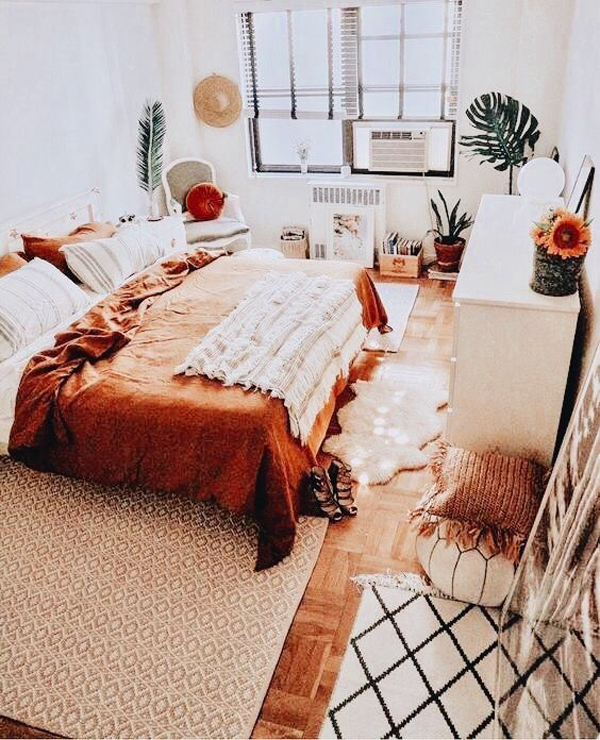
This screenshot has height=740, width=600. I want to click on brown comforter, so click(x=213, y=434).